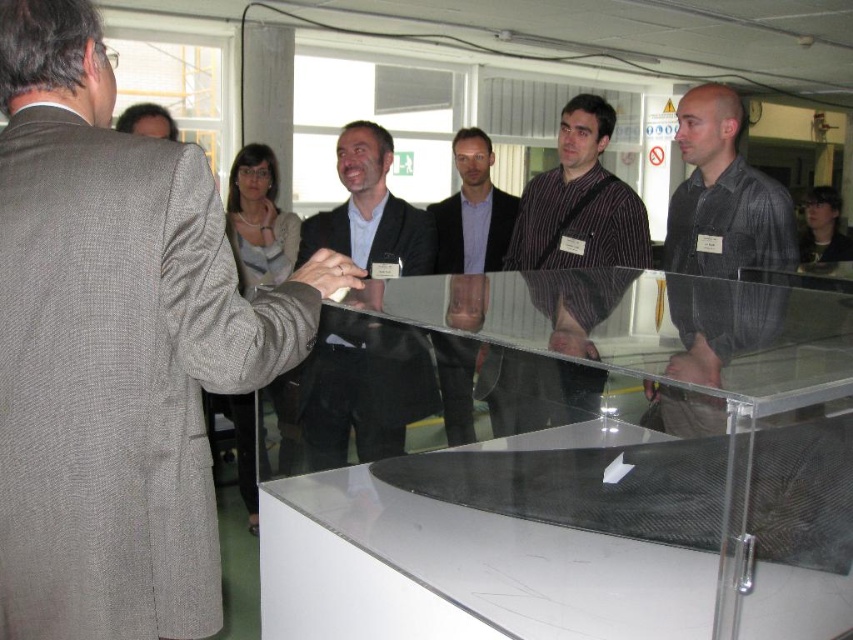
Who is higher up, dark gray striped shirt at center or matte black suit at center?

dark gray striped shirt at center is above.

Which is below, dark gray striped shirt at center or matte black suit at center?

matte black suit at center is lower down.

This screenshot has height=640, width=853. What are the coordinates of `dark gray striped shirt at center` in the screenshot? It's located at point(717,230).

Is transparent acrylic table at center closer to the viewer compared to matte black suit at center?

Yes, transparent acrylic table at center is in front of matte black suit at center.

Does point (355, 433) come closer to viewer compared to point (309, 424)?

That is False.

Describe the element at coordinates (570, 465) in the screenshot. I see `transparent acrylic table at center` at that location.

This screenshot has width=853, height=640. What are the coordinates of `transparent acrylic table at center` in the screenshot? It's located at (570, 465).

Consider the image. Measure the distance between point (134, 536) and camera.

Point (134, 536) and camera are 1.01 meters apart from each other.

From the picture: Does gray woolen suit at left have a lesser width compared to dark brown hair at upper right?

Correct, gray woolen suit at left's width is less than dark brown hair at upper right's.

Is point (39, 177) closer to viewer compared to point (821, 198)?

Yes, point (39, 177) is closer to viewer.

Where is `gray woolen suit at left`? The image size is (853, 640). gray woolen suit at left is located at coordinates (115, 348).